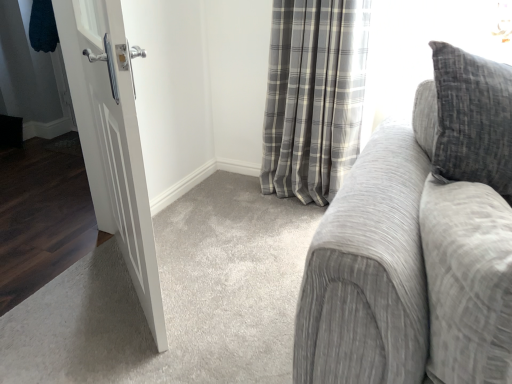
Question: Is textured gray couch at right at the back of gray plaid curtain at center?

Choices:
 (A) no
 (B) yes

Answer: (A)

Question: Could textured gray couch at right be considered to be inside gray plaid curtain at center?

Choices:
 (A) no
 (B) yes

Answer: (A)

Question: Is gray plaid curtain at center not near textured gray couch at right?

Choices:
 (A) yes
 (B) no

Answer: (A)

Question: From a real-world perspective, is gray plaid curtain at center under textured gray couch at right?

Choices:
 (A) yes
 (B) no

Answer: (A)

Question: Can you confirm if gray plaid curtain at center is bigger than textured gray couch at right?

Choices:
 (A) yes
 (B) no

Answer: (A)

Question: From a real-world perspective, is textured gray couch at right above or below white matte door at left?

Choices:
 (A) below
 (B) above

Answer: (B)

Question: Considering the positions of textured gray couch at right and white matte door at left in the image, is textured gray couch at right taller or shorter than white matte door at left?

Choices:
 (A) tall
 (B) short

Answer: (B)

Question: In terms of size, does textured gray couch at right appear bigger or smaller than white matte door at left?

Choices:
 (A) big
 (B) small

Answer: (A)

Question: In the image, is textured gray couch at right on the left side or the right side of white matte door at left?

Choices:
 (A) left
 (B) right

Answer: (B)

Question: Considering the positions of gray plaid curtain at center and white matte door at left in the image, is gray plaid curtain at center wider or thinner than white matte door at left?

Choices:
 (A) thin
 (B) wide

Answer: (B)

Question: Is gray plaid curtain at center taller or shorter than white matte door at left?

Choices:
 (A) tall
 (B) short

Answer: (B)

Question: Visually, is gray plaid curtain at center positioned to the left or to the right of white matte door at left?

Choices:
 (A) right
 (B) left

Answer: (A)

Question: Considering the positions of point (324, 132) and point (101, 178), is point (324, 132) closer or farther from the camera than point (101, 178)?

Choices:
 (A) closer
 (B) farther

Answer: (B)

Question: Is point (441, 134) positioned closer to the camera than point (284, 168)?

Choices:
 (A) farther
 (B) closer

Answer: (B)

Question: From their relative heights in the image, would you say textured gray couch at right is taller or shorter than gray plaid curtain at center?

Choices:
 (A) short
 (B) tall

Answer: (A)